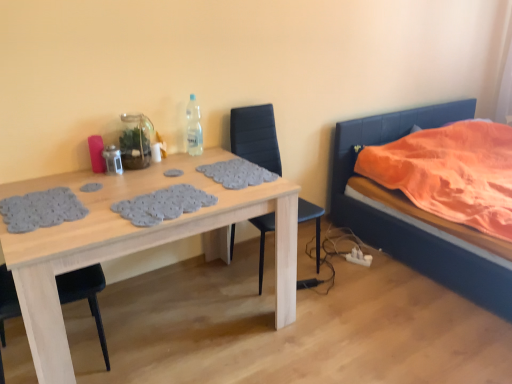
The width and height of the screenshot is (512, 384). I want to click on unoccupied region to the right of wooden table at center, so click(x=340, y=324).